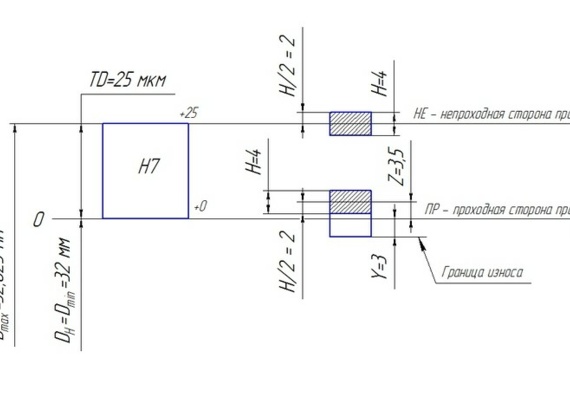
Image resolution: width=570 pixels, height=397 pixels. Identify the location of floor diagram. (229, 243).